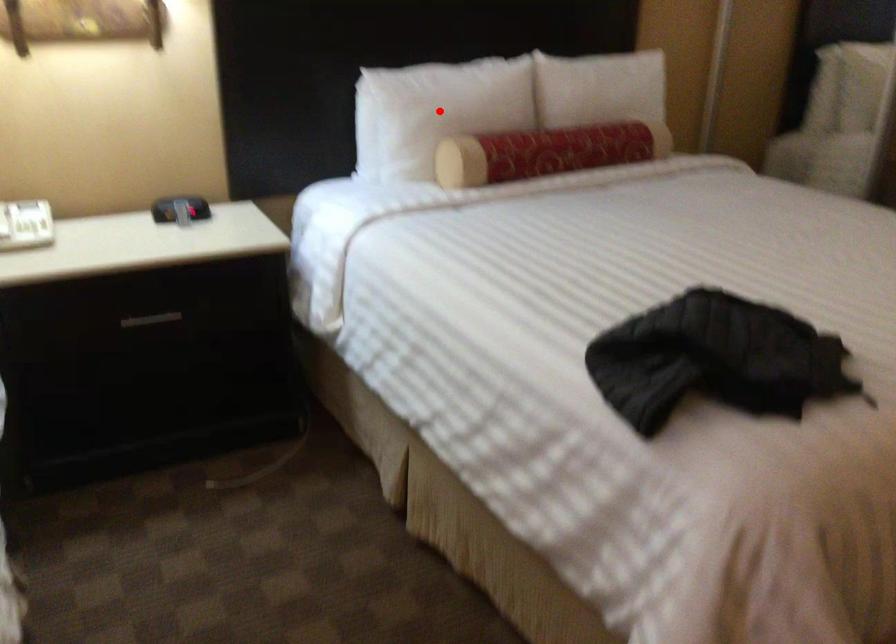
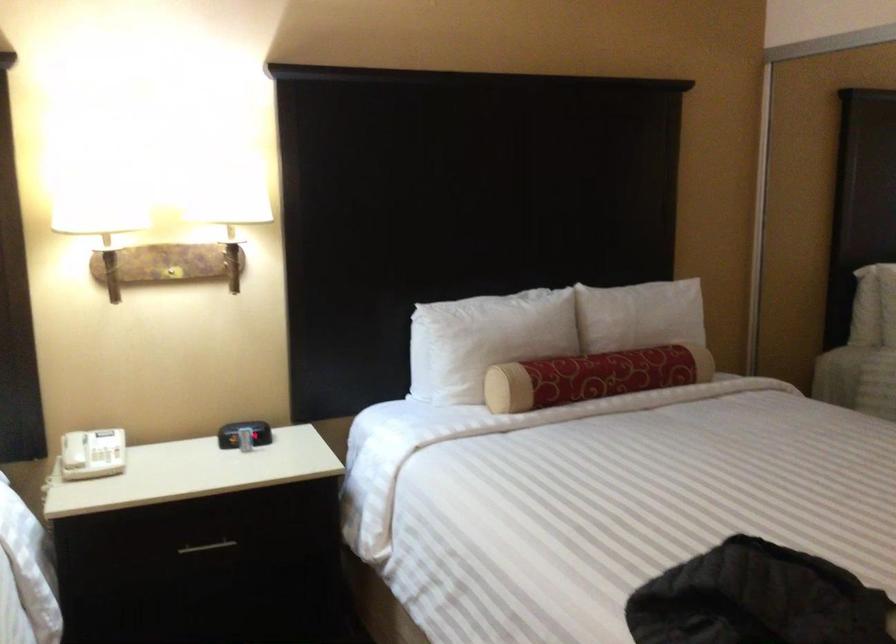
The point at the highlighted location is marked in the first image. Where is the corresponding point in the second image?

(485, 339)